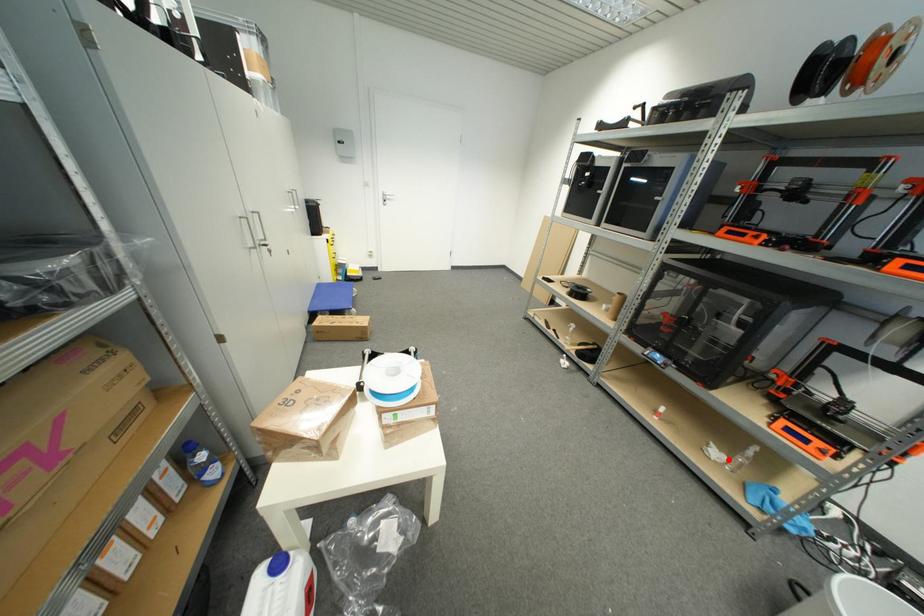
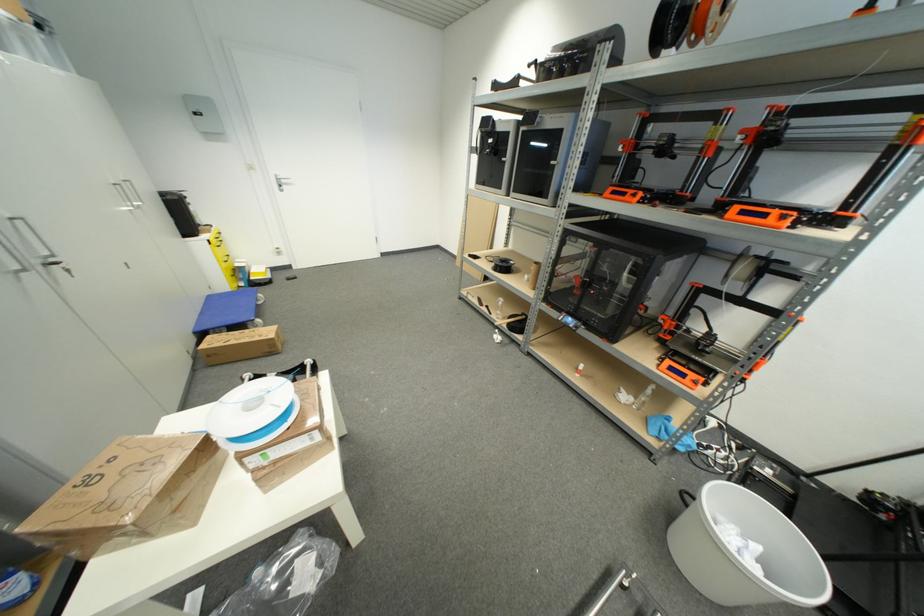
Question: I am providing you with two images of the same scene from different viewpoints. In image1, a red point is highlighted. Considering the same 3D point in image2, which of the following is correct?

Choices:
 (A) It is closer
 (B) It is farther

Answer: (B)